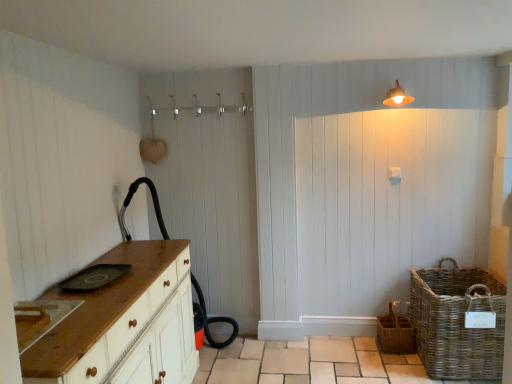
I want to click on vacant space to the left of woven wicker basket at lower right, positioned as the 1th basket in left-to-right order, so click(x=357, y=354).